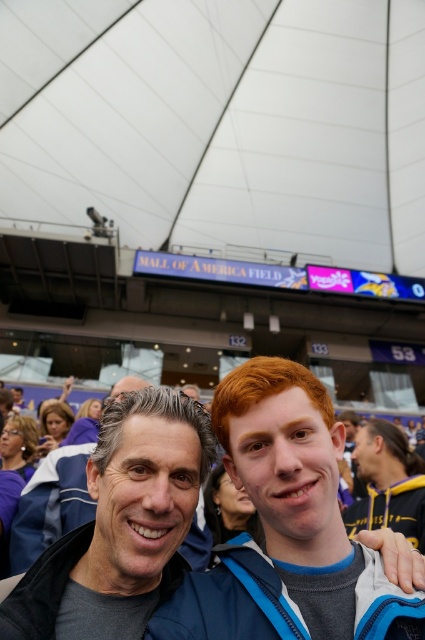
In the scene shown: Which is more to the left, matte blue jacket at center or dark blue jacket at center?

dark blue jacket at center is more to the left.

Who is higher up, matte blue jacket at center or dark blue jacket at center?

matte blue jacket at center is above.

Is point (223, 552) closer to camera compared to point (166, 547)?

That is True.

In order to click on matte blue jacket at center in this screenshot , I will do `click(286, 528)`.